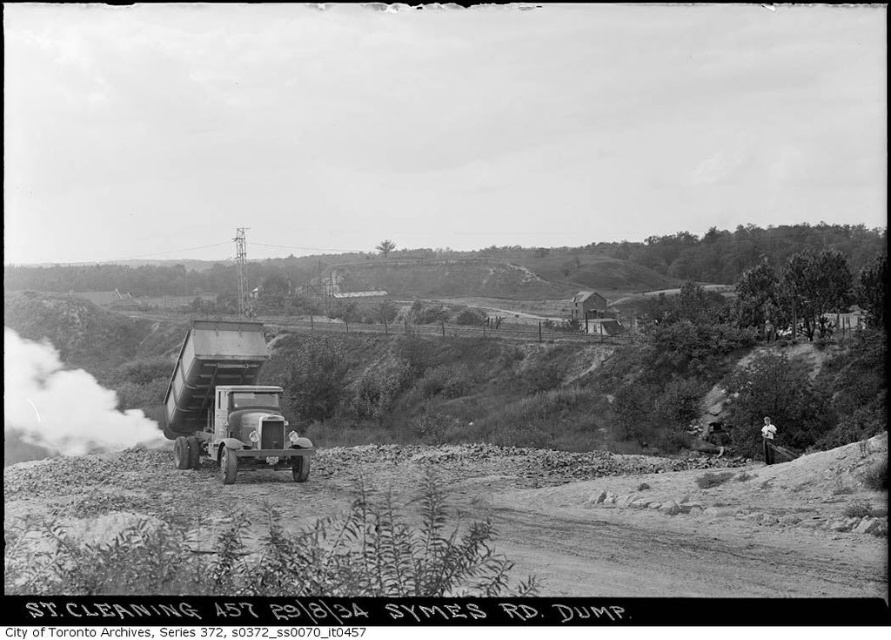
Question: Can you confirm if dirt track at lower center is positioned to the left of metallic silver trailer truck at center?

Choices:
 (A) no
 (B) yes

Answer: (A)

Question: Which of these objects is positioned farthest from the white smoke at center?

Choices:
 (A) dirt track at lower center
 (B) metallic silver trailer truck at center

Answer: (B)

Question: Does metallic silver trailer truck at center appear on the right side of white smoke at center?

Choices:
 (A) no
 (B) yes

Answer: (B)

Question: Is dirt track at lower center below white smoke at center?

Choices:
 (A) yes
 (B) no

Answer: (A)

Question: Which object appears closest to the camera in this image?

Choices:
 (A) dirt track at lower center
 (B) white smoke at center
 (C) metallic silver trailer truck at center

Answer: (A)

Question: Which of these objects is positioned closest to the dirt track at lower center?

Choices:
 (A) white smoke at center
 (B) metallic silver trailer truck at center

Answer: (B)